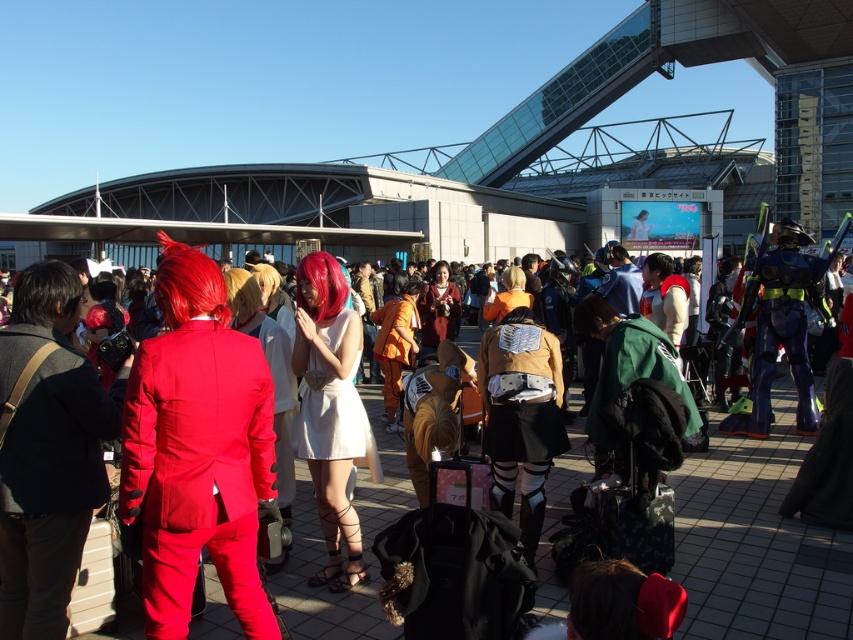
You are standing at point (x=426, y=301) and want to move to the exit located at point (x=308, y=364). Is the exit directly in front of you or behind you?

The exit at point (x=308, y=364) is in front of you because it is located in front of point (x=426, y=301) where you are standing.

You are organizing a photo shoot and need to arrange the matte red suit at center and the matte brown coat at center in a way that highlights their size difference. How should you position them relative to the camera to best emphasize this difference?

To emphasize the size difference between the matte red suit at center and the matte brown coat at center, position the smaller matte red suit at center closer to the camera and the larger matte brown coat at center further away. This arrangement will make the smaller suit appear larger in comparison, visually enhancing their size contrast.